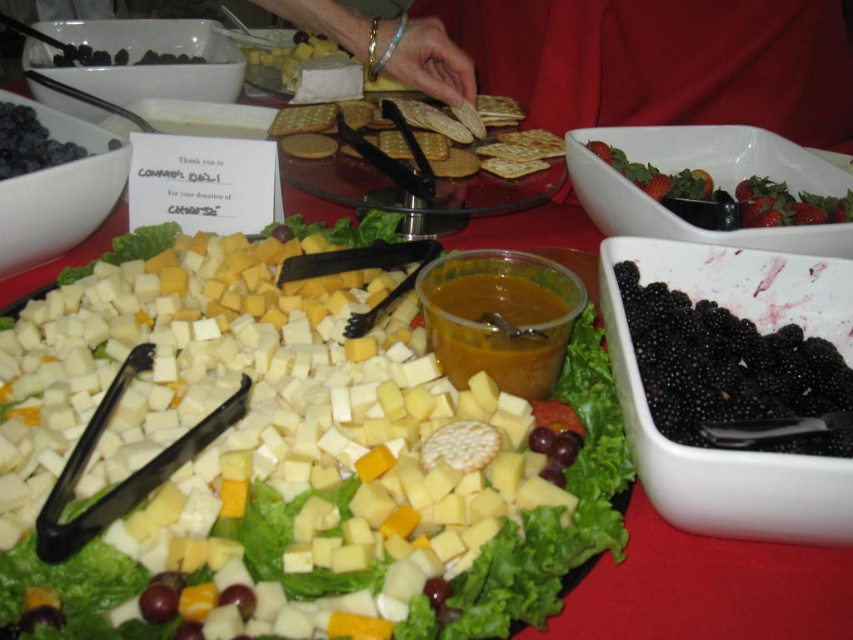
Is white crumbly cheese at center behind black glossy/blackberry at lower right?

No, white crumbly cheese at center is in front of black glossy/blackberry at lower right.

Is white crumbly cheese at center below black glossy/blackberry at lower right?

Correct, white crumbly cheese at center is located below black glossy/blackberry at lower right.

Is point (515, 554) in front of point (639, 323)?

Yes, it is in front of point (639, 323).

The width and height of the screenshot is (853, 640). Identify the location of white crumbly cheese at center. (206, 413).

Who is taller, black glossy/blackberry at lower right or red glossy strawberries at upper right?

red glossy strawberries at upper right is taller.

Between point (663, 310) and point (677, 202), which one is positioned in front?

Point (663, 310) is in front.

Image resolution: width=853 pixels, height=640 pixels. Find the location of `black glossy/blackberry at lower right`. black glossy/blackberry at lower right is located at coordinates click(x=730, y=371).

Is point (747, 202) less distant than point (3, 100)?

Yes, it is.

Where is `red glossy strawberries at upper right`? Image resolution: width=853 pixels, height=640 pixels. red glossy strawberries at upper right is located at coordinates (724, 195).